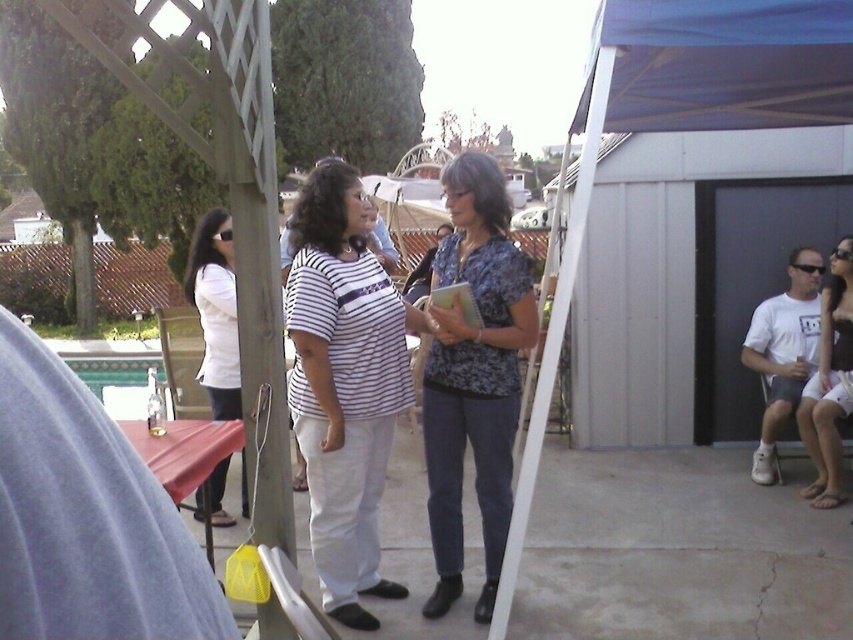
You are attending a backyard gathering and see two women in white shirts. The one wearing the white striped shirt at center and the other in the white matte shirt at left. Which woman is standing to the right of the other?

The white striped shirt at center is positioned on the right side of the white matte shirt at left, so the woman in the white striped shirt at center is standing to the right of the woman in the white matte shirt at left.

You are a photographer trying to capture a photo of the blue fabric canopy at upper right and the white matte shirt at left. Which object should you focus on first to ensure both are in focus?

The blue fabric canopy at upper right is closer to the viewer than the white matte shirt at left, so you should focus on the blue fabric canopy at upper right first to ensure both are in focus.